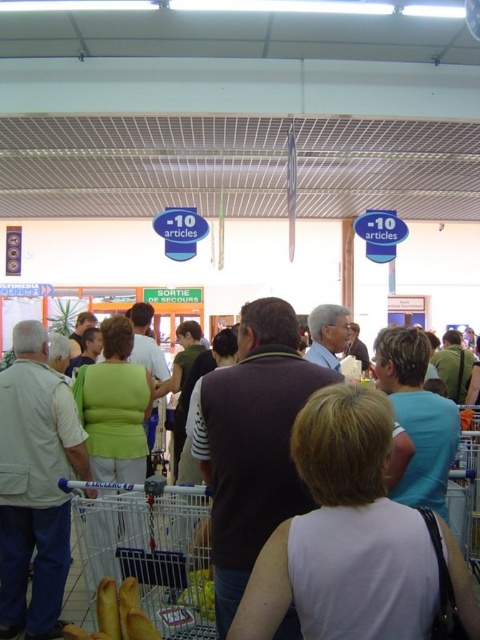
Question: Estimate the real-world distances between objects in this image. Which object is farther from the green matte shirt at center?

Choices:
 (A) matte gray shirt at center
 (B) light beige cotton shirt at center
 (C) dark brown sweater at center
 (D) metallic silver shopping cart at lower left

Answer: (C)

Question: Among these points, which one is farthest from the camera?

Choices:
 (A) (13, 424)
 (B) (323, 333)

Answer: (B)

Question: Which point is farther from the camera taking this photo?

Choices:
 (A) (321, 344)
 (B) (373, 429)
 (C) (78, 374)

Answer: (A)

Question: Does light beige cotton shirt at center have a greater width compared to matte green shirt at center?

Choices:
 (A) no
 (B) yes

Answer: (A)

Question: Does white matte shirt at center appear under light beige cotton shirt at center?

Choices:
 (A) yes
 (B) no

Answer: (B)

Question: Does metallic silver shopping cart at lower left appear over green matte shirt at center?

Choices:
 (A) no
 (B) yes

Answer: (A)